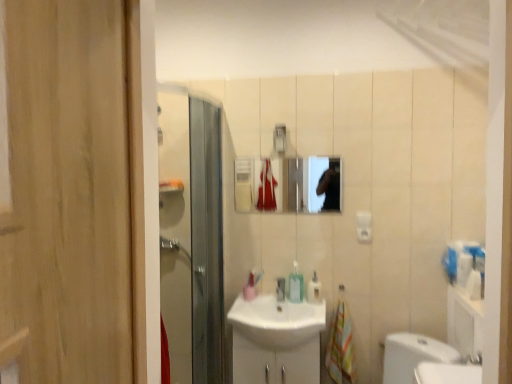
Measure the distance between translucent plastic soap dispenser at center, positioned as the 1th soap dispenser in right-to-left order, and camera.

translucent plastic soap dispenser at center, positioned as the 1th soap dispenser in right-to-left order, and camera are 2.37 meters apart from each other.

The width and height of the screenshot is (512, 384). Describe the element at coordinates (341, 346) in the screenshot. I see `multicolored fabric hand towel at lower right` at that location.

The height and width of the screenshot is (384, 512). Describe the element at coordinates (289, 184) in the screenshot. I see `matte glass mirror at upper center` at that location.

Image resolution: width=512 pixels, height=384 pixels. What are the coordinates of `matte silver faucet at sink center` in the screenshot? It's located at (280, 289).

Between point (329, 353) and point (309, 288), which one is positioned in front?

Point (329, 353)

Which is correct: multicolored fabric hand towel at lower right is inside translucent plastic soap dispenser at center, positioned as the 1th soap dispenser in right-to-left order, or outside of it?

multicolored fabric hand towel at lower right exists outside the volume of translucent plastic soap dispenser at center, positioned as the 1th soap dispenser in right-to-left order.

From the image's perspective, which is below, multicolored fabric hand towel at lower right or translucent plastic soap dispenser at center, positioned as the 1th soap dispenser in right-to-left order?

multicolored fabric hand towel at lower right, from the image's perspective.

Is translucent plastic soap dispenser at center, positioned as the 1th soap dispenser in right-to-left order, in contact with matte glass mirror at upper center?

No, translucent plastic soap dispenser at center, positioned as the 1th soap dispenser in right-to-left order, is not making contact with matte glass mirror at upper center.

Is translucent plastic soap dispenser at center, the second soap dispenser viewed from the left, thinner than matte glass mirror at upper center?

Incorrect, the width of translucent plastic soap dispenser at center, the second soap dispenser viewed from the left, is not less than that of matte glass mirror at upper center.

Is matte glass mirror at upper center completely or partially inside translucent plastic soap dispenser at center, positioned as the 1th soap dispenser in right-to-left order?

No, matte glass mirror at upper center is not inside translucent plastic soap dispenser at center, positioned as the 1th soap dispenser in right-to-left order.

Is translucent plastic soap dispenser at center, the second soap dispenser viewed from the left, at the right side of matte glass mirror at upper center?

Correct, you'll find translucent plastic soap dispenser at center, the second soap dispenser viewed from the left, to the right of matte glass mirror at upper center.

Considering the relative sizes of multicolored fabric hand towel at lower right and white glossy sink at center in the image provided, is multicolored fabric hand towel at lower right wider than white glossy sink at center?

In fact, multicolored fabric hand towel at lower right might be narrower than white glossy sink at center.

Is white glossy sink at center a part of multicolored fabric hand towel at lower right?

No, multicolored fabric hand towel at lower right does not contain white glossy sink at center.

Is the depth of multicolored fabric hand towel at lower right greater than that of white glossy sink at center?

Yes, multicolored fabric hand towel at lower right is further from the viewer.

Does matte glass mirror at upper center turn towards multicolored fabric hand towel at lower right?

No, matte glass mirror at upper center is not facing towards multicolored fabric hand towel at lower right.

From a real-world perspective, between matte glass mirror at upper center and multicolored fabric hand towel at lower right, who is vertically higher?

matte glass mirror at upper center.

Which object is positioned more to the left, matte glass mirror at upper center or multicolored fabric hand towel at lower right?

From the viewer's perspective, matte glass mirror at upper center appears more on the left side.

Where is `hand towel that is under the matte glass mirror at upper center (from a real-world perspective)`? hand towel that is under the matte glass mirror at upper center (from a real-world perspective) is located at coordinates (341, 346).

From the image's perspective, is white glossy sink at center below translucent plastic soap dispenser at center, the second soap dispenser viewed from the left?

Yes.

From a real-world perspective, is white glossy sink at center positioned over translucent plastic soap dispenser at center, positioned as the 1th soap dispenser in right-to-left order, based on gravity?

No, from a real-world perspective, white glossy sink at center is not on top of translucent plastic soap dispenser at center, positioned as the 1th soap dispenser in right-to-left order.

Where is `sink that is on the left side of translucent plastic soap dispenser at center, positioned as the 1th soap dispenser in right-to-left order`? sink that is on the left side of translucent plastic soap dispenser at center, positioned as the 1th soap dispenser in right-to-left order is located at coordinates (277, 321).

Is white glossy sink at center further to the viewer compared to translucent plastic soap dispenser at center, the second soap dispenser viewed from the left?

No, the depth of white glossy sink at center is less than that of translucent plastic soap dispenser at center, the second soap dispenser viewed from the left.

Considering the relative positions of matte silver faucet at sink center and multicolored fabric hand towel at lower right in the image provided, is matte silver faucet at sink center behind multicolored fabric hand towel at lower right?

Yes, the depth of matte silver faucet at sink center is greater than that of multicolored fabric hand towel at lower right.

In order to click on hand towel lying in front of the matte silver faucet at sink center in this screenshot , I will do `click(341, 346)`.

Considering the positions of objects matte silver faucet at sink center and multicolored fabric hand towel at lower right in the image provided, who is more to the right, matte silver faucet at sink center or multicolored fabric hand towel at lower right?

From the viewer's perspective, multicolored fabric hand towel at lower right appears more on the right side.

Which is further, (x=280, y=284) or (x=346, y=349)?

The point (x=280, y=284) is behind.

Where is `hand towel behind the white glossy sink at center`? The height and width of the screenshot is (384, 512). hand towel behind the white glossy sink at center is located at coordinates (341, 346).

From a real-world perspective, is white glossy sink at center positioned over multicolored fabric hand towel at lower right based on gravity?

No, from a real-world perspective, white glossy sink at center is not over multicolored fabric hand towel at lower right

Is white glossy sink at center to the right of multicolored fabric hand towel at lower right from the viewer's perspective?

In fact, white glossy sink at center is to the left of multicolored fabric hand towel at lower right.

Is white glossy sink at center oriented away from multicolored fabric hand towel at lower right?

No, white glossy sink at center's orientation is not away from multicolored fabric hand towel at lower right.

Image resolution: width=512 pixels, height=384 pixels. What are the coordinates of `hand towel below the translucent plastic soap dispenser at center, the second soap dispenser viewed from the left (from a real-world perspective)` in the screenshot? It's located at tap(341, 346).

This screenshot has height=384, width=512. Find the location of `mirror that appears above the translucent plastic soap dispenser at center, positioned as the 1th soap dispenser in right-to-left order (from a real-world perspective)`. mirror that appears above the translucent plastic soap dispenser at center, positioned as the 1th soap dispenser in right-to-left order (from a real-world perspective) is located at coordinates (289, 184).

Looking at the image, which one is located closer to white glossy sink at center, translucent plastic soap dispenser at center, positioned as the 1th soap dispenser in left-to-right order, or matte silver faucet at sink center?

translucent plastic soap dispenser at center, positioned as the 1th soap dispenser in left-to-right order.

Which object lies further to the anchor point multicolored fabric hand towel at lower right, white glossy sink at center or translucent plastic soap dispenser at center, which appears as the second soap dispenser when viewed from the right?

The object further to multicolored fabric hand towel at lower right is translucent plastic soap dispenser at center, which appears as the second soap dispenser when viewed from the right.

Looking at the image, which one is located further to white glossy sink at center, matte glass mirror at upper center or translucent plastic soap dispenser at center, positioned as the 1th soap dispenser in left-to-right order?

matte glass mirror at upper center lies further to white glossy sink at center than the other object.

Which object lies nearer to the anchor point white glossy sink at center, multicolored fabric hand towel at lower right or matte glass mirror at upper center?

multicolored fabric hand towel at lower right.

Looking at the image, which one is located further to matte silver faucet at sink center, translucent plastic soap dispenser at center, positioned as the 1th soap dispenser in left-to-right order, or translucent plastic soap dispenser at center, positioned as the 1th soap dispenser in right-to-left order?

Based on the image, translucent plastic soap dispenser at center, positioned as the 1th soap dispenser in right-to-left order, appears to be further to matte silver faucet at sink center.

When comparing their distances from multicolored fabric hand towel at lower right, does matte glass mirror at upper center or translucent plastic soap dispenser at center, which appears as the second soap dispenser when viewed from the right, seem further?

matte glass mirror at upper center is further to multicolored fabric hand towel at lower right.

Looking at the image, which one is located closer to white glossy sink at center, matte glass mirror at upper center or multicolored fabric hand towel at lower right?

Among the two, multicolored fabric hand towel at lower right is located nearer to white glossy sink at center.

Which object lies nearer to the anchor point white glossy sink at center, white glossy sink at center or translucent plastic soap dispenser at center, the second soap dispenser viewed from the left?

Among the two, white glossy sink at center is located nearer to white glossy sink at center.

This screenshot has height=384, width=512. Find the location of `soap dispenser between white glossy sink at center and translucent plastic soap dispenser at center, which appears as the second soap dispenser when viewed from the right, along the z-axis`. soap dispenser between white glossy sink at center and translucent plastic soap dispenser at center, which appears as the second soap dispenser when viewed from the right, along the z-axis is located at coordinates (314, 289).

Image resolution: width=512 pixels, height=384 pixels. What are the coordinates of `sink between translucent plastic soap dispenser at center, the second soap dispenser viewed from the left, and white glossy sink at center vertically` in the screenshot? It's located at (277, 321).

At what (x,y) coordinates should I click in order to perform the action: click on bathroom cabinet between white glossy sink at center and multicolored fabric hand towel at lower right from left to right. Please return your answer as a coordinate pair (x, y). The width and height of the screenshot is (512, 384). Looking at the image, I should click on (275, 362).

Locate an element on the screen. The width and height of the screenshot is (512, 384). tap that lies between translucent plastic soap dispenser at center, the second soap dispenser viewed from the left, and white glossy sink at center from top to bottom is located at coordinates (280, 289).